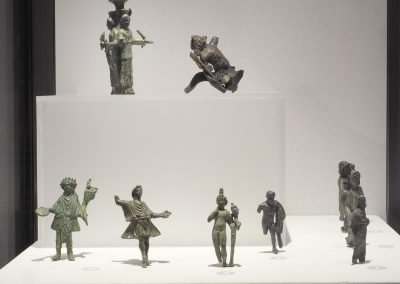
At what (x,y) coordinates should I click in order to perform the action: click on white wall. Please return your answer as a coordinate pair (x, y). This screenshot has height=284, width=400. Looking at the image, I should click on tap(301, 95).